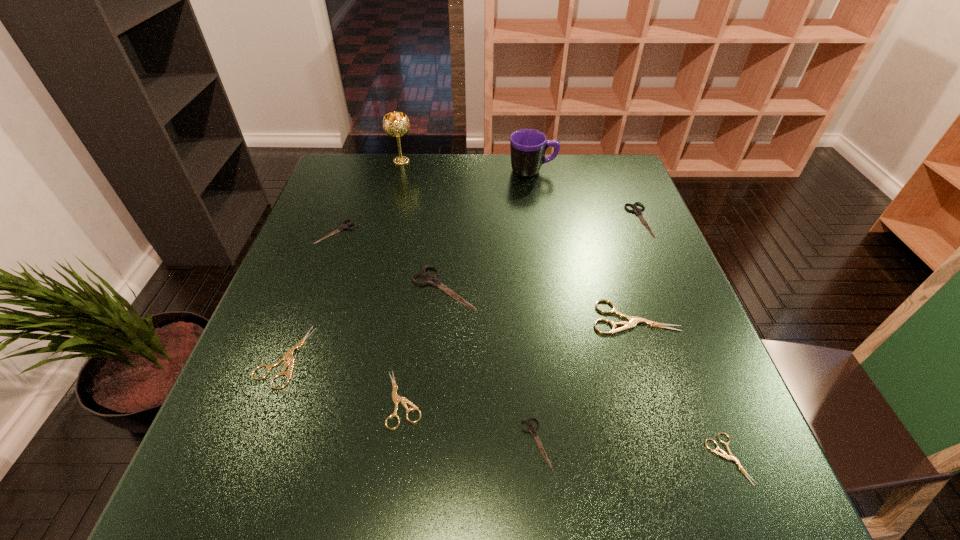
This screenshot has height=540, width=960. What are the coordinates of `vacant space located 0.290m on the right of the second smallest black shears` in the screenshot? It's located at [x=467, y=232].

At what (x,y) coordinates should I click in order to perform the action: click on free space located 0.190m on the right of the leftmost beige shears. Please return your answer as a coordinate pair (x, y). Looking at the image, I should click on [403, 357].

Locate an element on the screen. vacant space located on the left of the third beige shears from right to left is located at coordinates (237, 399).

This screenshot has height=540, width=960. I want to click on free space located on the right of the fifth shears from left to right, so click(x=595, y=442).

This screenshot has width=960, height=540. In order to click on vacant point located on the back of the shortest object in this screenshot , I will do `click(656, 278)`.

You are a GUI agent. You are given a task and a screenshot of the screen. Output one action in this format:
    pyautogui.click(x=<x>, y=<y>)
    Task: Click on the chalice that is at the far edge
    The image size is (960, 540).
    Given the screenshot: What is the action you would take?
    pyautogui.click(x=395, y=124)

You are a GUI agent. You are given a task and a screenshot of the screen. Output one action in this format:
    pyautogui.click(x=<x>, y=<y>)
    Task: Click on the mug at the far edge
    The height and width of the screenshot is (540, 960).
    Given the screenshot: What is the action you would take?
    pyautogui.click(x=528, y=146)

Identify the location of object that is at the near right corner. The image size is (960, 540). (724, 455).

Find the location of `vacant area at the far edge`. vacant area at the far edge is located at coordinates (444, 176).

At what (x,y) coordinates should I click in order to perform the action: click on free space at the left edge of the desktop. Please return your answer as a coordinate pair (x, y). This screenshot has width=960, height=540. Looking at the image, I should click on (340, 211).